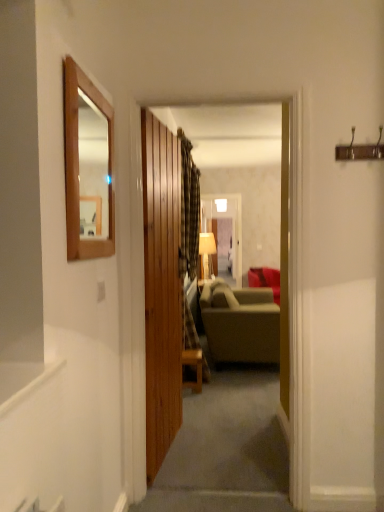
Question: Is point (76, 95) closer or farther from the camera than point (200, 373)?

Choices:
 (A) farther
 (B) closer

Answer: (B)

Question: Considering their positions, is wooden framed mirror at upper left located in front of or behind wooden table at center?

Choices:
 (A) front
 (B) behind

Answer: (A)

Question: Which of these objects is positioned closest to the wooden door at center?

Choices:
 (A) matte gray fabric couch at center, the 1th studio couch when ordered from front to back
 (B) wooden table at center
 (C) wooden framed mirror at upper left
 (D) wooden paneling at center
 (E) plaid fabric curtain at center

Answer: (C)

Question: Which is farther from the matte beige lampshade at center?

Choices:
 (A) matte gray fabric couch at center, the 1th studio couch when ordered from front to back
 (B) wooden table at center
 (C) plaid fabric curtain at center
 (D) wooden framed mirror at upper left
 (E) wooden door at center

Answer: (D)